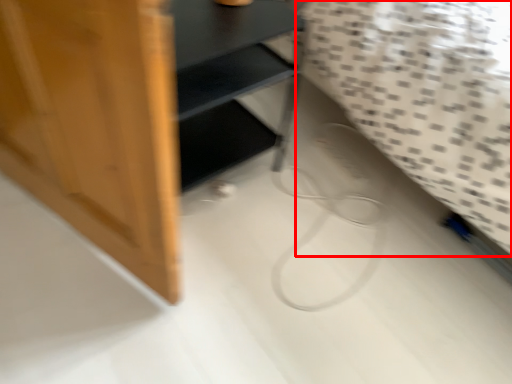
Question: From the image's perspective, what is the correct spatial relationship of sheet (annotated by the red box) in relation to furniture?

Choices:
 (A) above
 (B) below

Answer: (A)